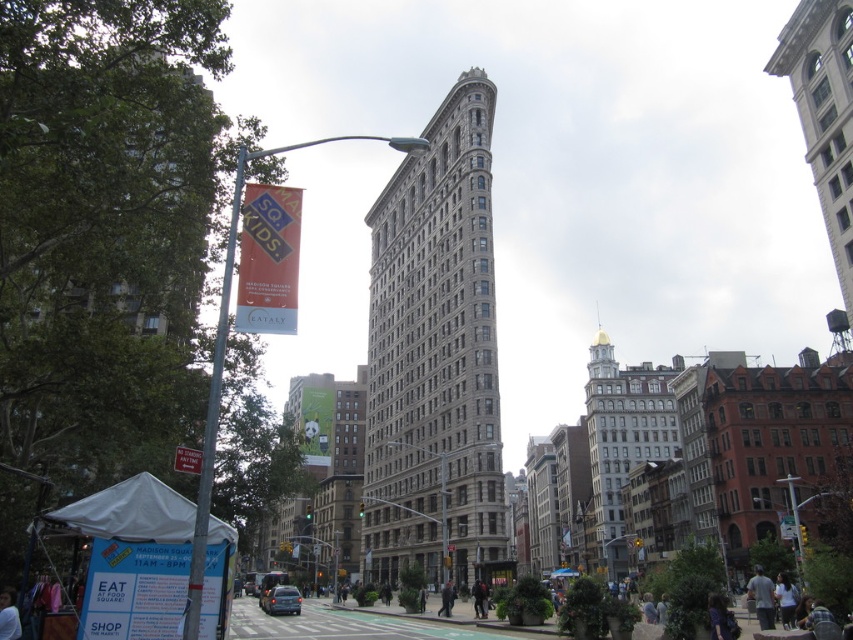
You are standing on the sidewalk in front of the gray stone building at center. You want to take a photo of the building that includes the entire structure in the frame. Based on the distance between you and the building, is it possible to capture the entire building in one shot without moving your camera position?

The gray stone building at center is 171.47 feet away from the viewer. To capture the entire structure in a single photo without moving the camera, you would need a wide enough lens or camera angle that can encompass the building from its base to the top within the frame at that distance. However, the feasibility depends on the camera equipment used. If the camera has a sufficiently wide field of view, it should be possible. Otherwise, a wider lens or moving slightly back might be necessary.

You are a city planner assessing the street layout. You need to install a new traffic light that must be taller than both the metallic pole at left and the white plastic street sign at center. Based on the current sizes, is this feasible?

The metallic pole at left is larger in size than the white plastic street sign at center. Since the traffic light needs to be taller than both, it must exceed the height of the metallic pole at left, which is the larger of the two. Therefore, installing a traffic light taller than both is possible as long as it surpasses the metallic pole at left in height.

In the scene shown: You are a tourist standing in the middle of the street looking at the iconic building. You notice the light gray shirt at lower right and the red plastic sign at lower left. Which object is closer to you?

The light gray shirt at lower right is closer to you because the red plastic sign at lower left is behind it.